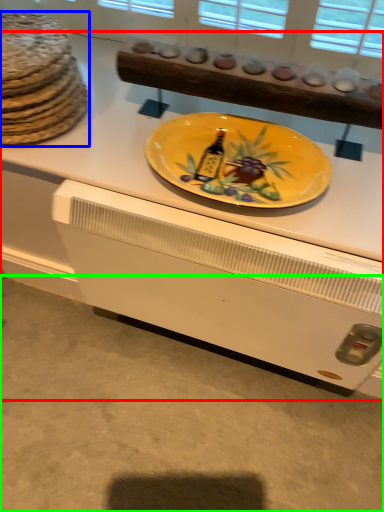
Question: Estimate the real-world distances between objects in this image. Which object is closer to desk (highlighted by a red box), chocolate cake (highlighted by a blue box) or concrete (highlighted by a green box)?

Choices:
 (A) chocolate cake
 (B) concrete

Answer: (A)